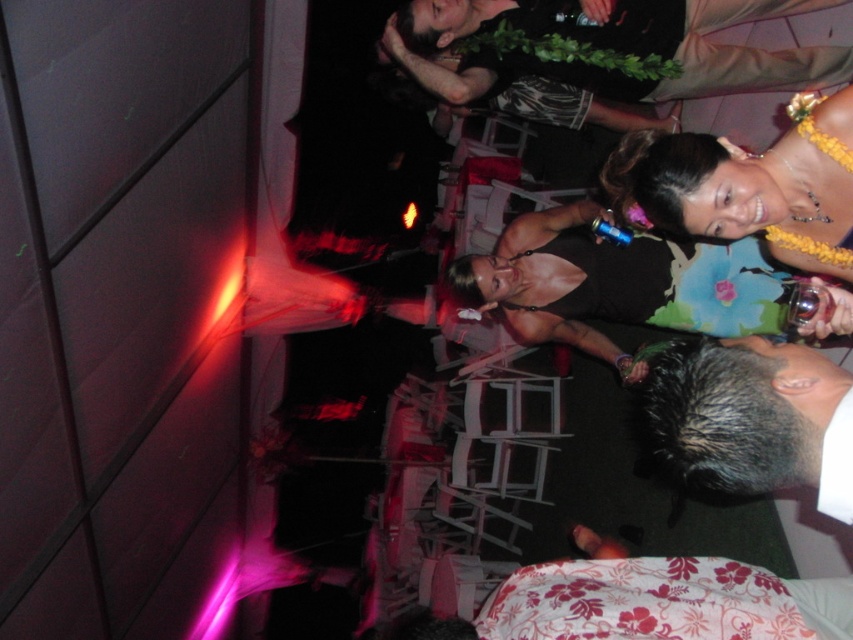
You are organizing a coat rack at the entrance of the party venue. You have a light brown leather jacket at upper center and a floral fabric lei at upper right. Which item takes up more space on the coat rack?

The light brown leather jacket at upper center is larger in size than the floral fabric lei at upper right, so it takes up more space on the coat rack.

You are at the party and want to move from the location of point (x=721, y=353) to point (x=770, y=224). Is the path between them clear?

Point (x=721, y=353) is in front of point (x=770, y=224), so the path between them is clear.

You are at a party and want to take a photo of the gray hair at lower right and the floral fabric lei at upper right. Which object is closer to the camera?

The gray hair at lower right is shorter than the floral fabric lei at upper right, so the gray hair at lower right is closer to the camera.